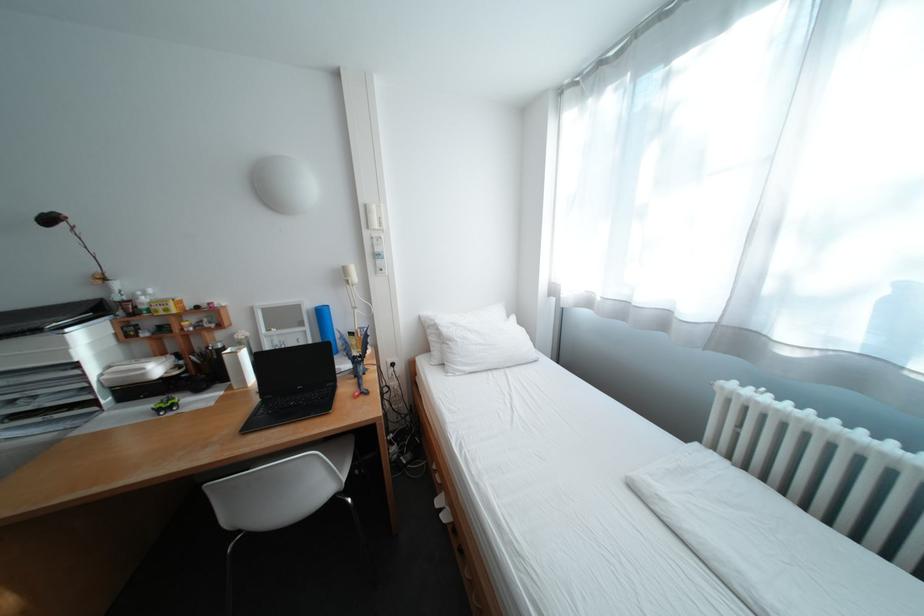
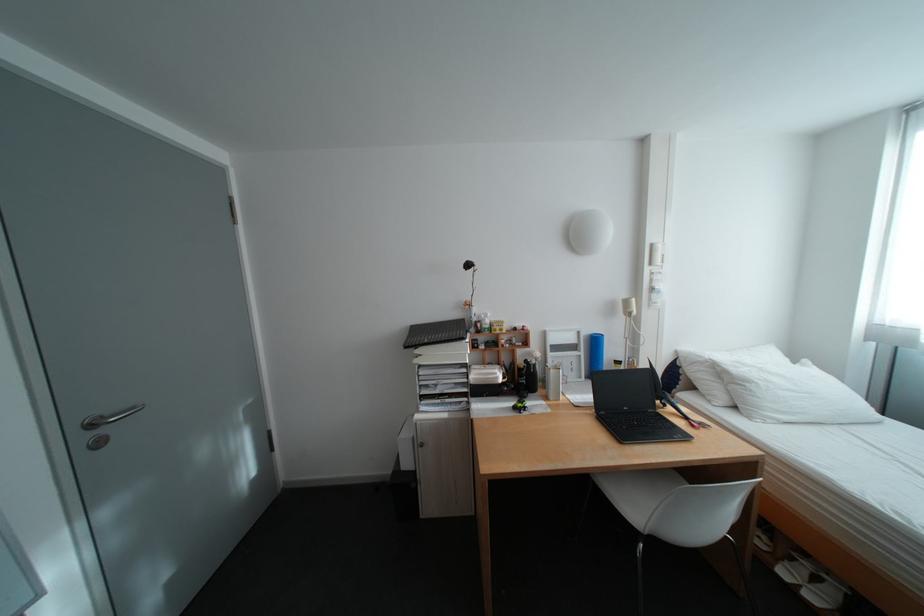
Where in the second image is the point corresponding to [456,509] from the first image?

(813, 586)